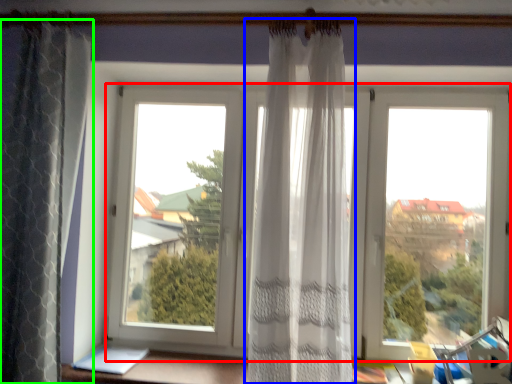
Question: Which is farther away from window (highlighted by a red box)? curtain (highlighted by a blue box) or curtain (highlighted by a green box)?

Choices:
 (A) curtain
 (B) curtain

Answer: (B)